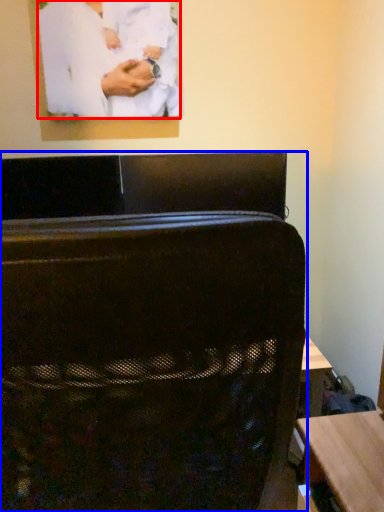
Question: Which object appears closest to the camera in this image, person (highlighted by a red box) or furniture (highlighted by a blue box)?

Choices:
 (A) person
 (B) furniture

Answer: (B)